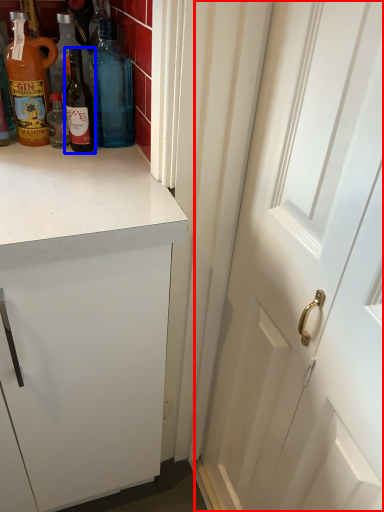
Question: Which object is closer to the camera taking this photo, door (highlighted by a red box) or bottle (highlighted by a blue box)?

Choices:
 (A) door
 (B) bottle

Answer: (A)